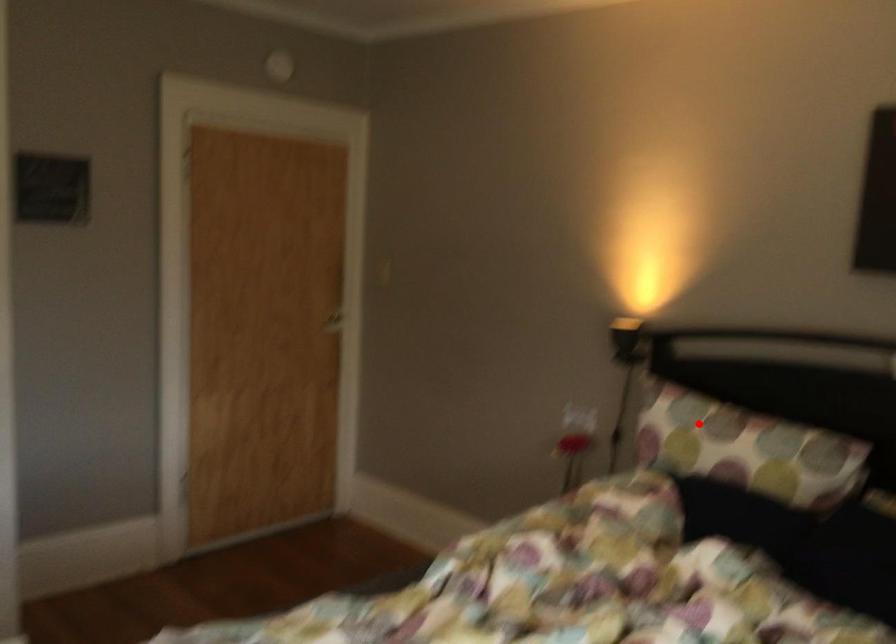
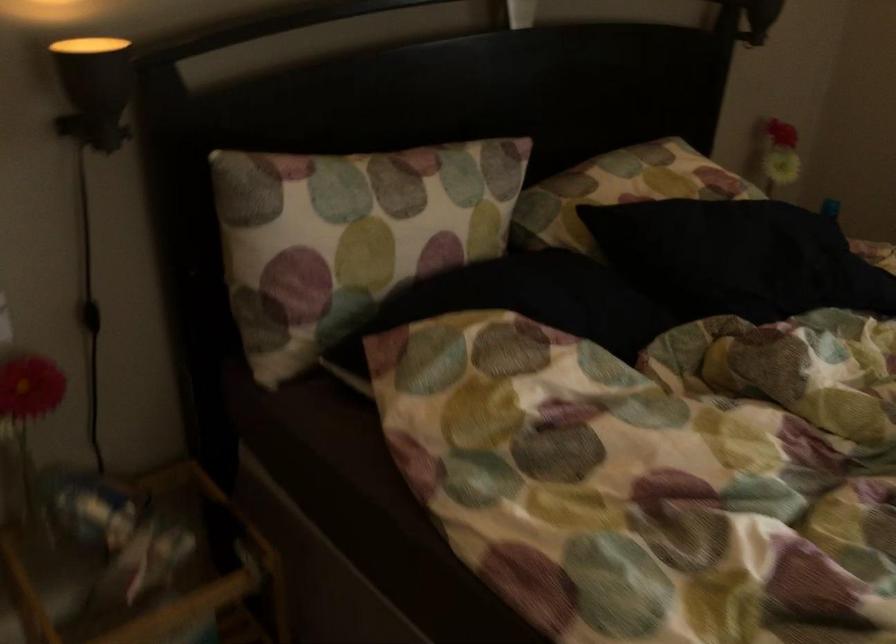
Where in the second image is the point corresponding to the highlighted location from the first image?

(367, 207)